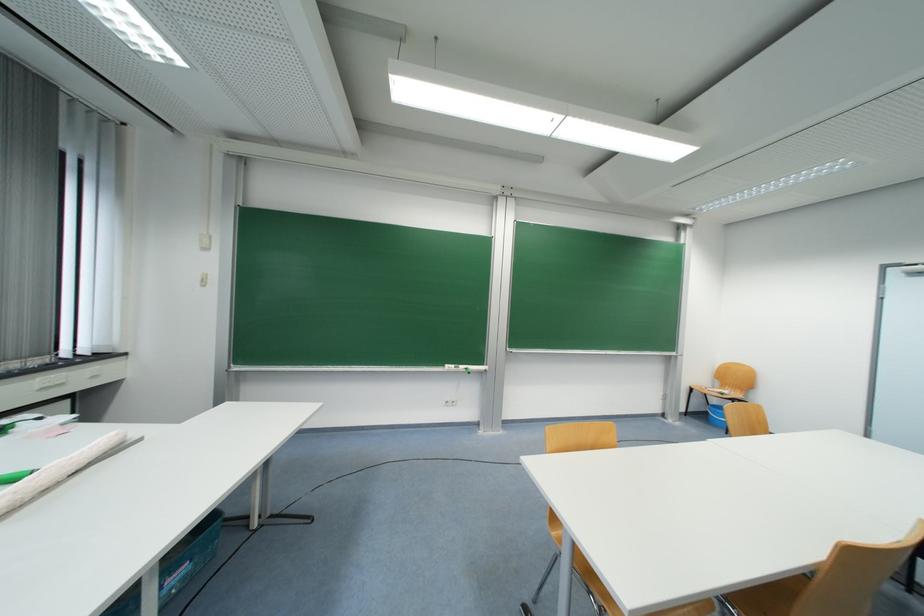
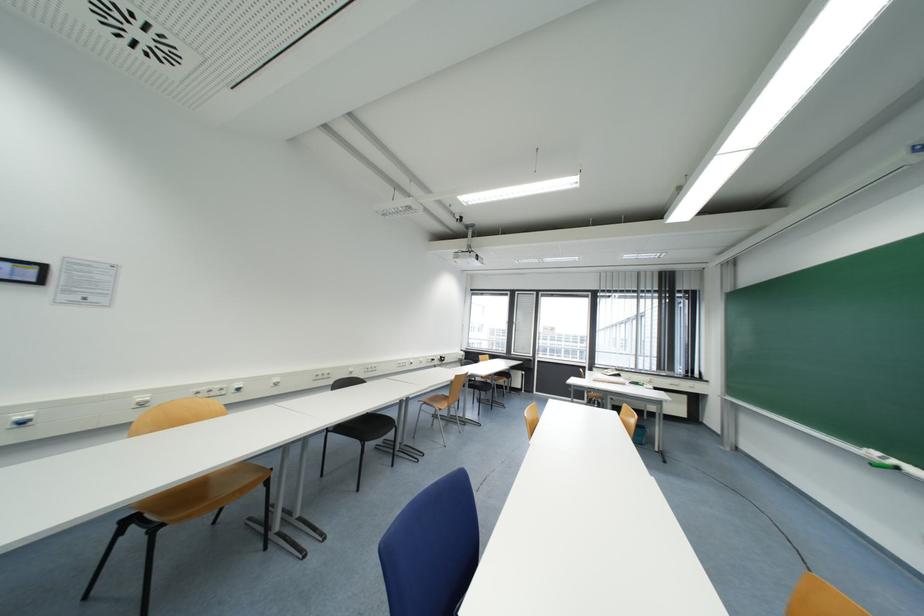
Find the pixel in the second image that matches pixel 467 369 in the first image.

(898, 464)